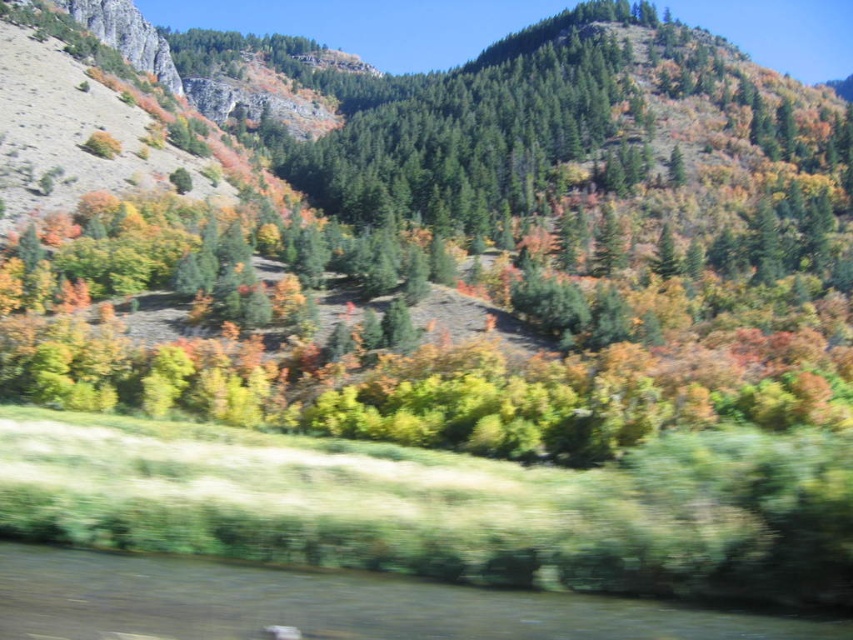
You are a hiker trying to navigate through the forest. You see the green matte tree at center. Can you estimate its position relative to the center of the image?

The green matte tree at center is located at the coordinates 0.389 on the x axis and 0.565 on the y axis, which is slightly to the left and below the exact center of the image.